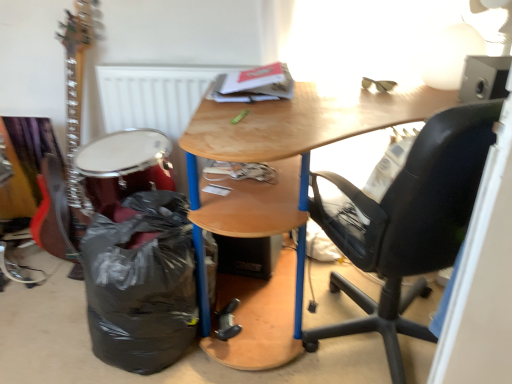
What do you see at coordinates (278, 198) in the screenshot?
I see `wooden desk at center` at bounding box center [278, 198].

The image size is (512, 384). What are the coordinates of `wooden desk at center` in the screenshot? It's located at (278, 198).

Describe the element at coordinates (156, 100) in the screenshot. This screenshot has height=384, width=512. I see `white matte radiator at upper center` at that location.

Find the location of a particular element. black leather office chair at right is located at coordinates (409, 223).

Considering the sizes of shiny red drum at lower left and black leather office chair at right in the image, is shiny red drum at lower left wider or thinner than black leather office chair at right?

Clearly, shiny red drum at lower left has less width compared to black leather office chair at right.

Is shiny red drum at lower left aimed at black leather office chair at right?

No, shiny red drum at lower left is not aimed at black leather office chair at right.

From a real-world perspective, is shiny red drum at lower left above or below black leather office chair at right?

In terms of real-world spatial position, shiny red drum at lower left is below black leather office chair at right.

From the image's perspective, between shiny red drum at lower left and black leather office chair at right, who is located below?

From the image's view, black leather office chair at right is below.

This screenshot has height=384, width=512. In order to click on desk that is above the shiny red drum at lower left (from a real-world perspective) in this screenshot , I will do `click(278, 198)`.

Considering the sizes of objects shiny red drum at lower left and wooden desk at center in the image provided, who is smaller, shiny red drum at lower left or wooden desk at center?

With smaller size is shiny red drum at lower left.

Is shiny red drum at lower left taller than wooden desk at center?

No, shiny red drum at lower left is not taller than wooden desk at center.

Which object is positioned more to the right, shiny red drum at lower left or wooden desk at center?

wooden desk at center.

Is wooden desk at center facing away from white matte radiator at upper center?

No, wooden desk at center is not facing away from white matte radiator at upper center.

From the image's perspective, which is below, wooden desk at center or white matte radiator at upper center?

wooden desk at center appears lower in the image.

Can you see black leather office chair at right touching wooden desk at center?

No, black leather office chair at right is not next to wooden desk at center.

Is black leather office chair at right not within wooden desk at center?

That's incorrect, black leather office chair at right is not completely outside wooden desk at center.

Could you tell me if black leather office chair at right is facing wooden desk at center?

Yes, black leather office chair at right is facing wooden desk at center.

Is wooden desk at center at the back of black plastic bag at lower left?

black plastic bag at lower left does not have its back to wooden desk at center.

From the image's perspective, is black plastic bag at lower left on wooden desk at center?

No, from the image's perspective, black plastic bag at lower left is not on top of wooden desk at center.

Could wooden desk at center be considered to be inside black plastic bag at lower left?

Definitely not — wooden desk at center is not inside black plastic bag at lower left.

From a real-world perspective, is black plastic bag at lower left over wooden desk at center?

No, from a real-world perspective, black plastic bag at lower left is not over wooden desk at center

Can you see black plastic bag at lower left touching black leather office chair at right?

No, black plastic bag at lower left is not in contact with black leather office chair at right.

Between black plastic bag at lower left and black leather office chair at right, which one has more height?

black leather office chair at right.

Image resolution: width=512 pixels, height=384 pixels. Identify the location of chair in front of the black plastic bag at lower left. click(x=409, y=223).

Considering the sizes of objects black plastic bag at lower left and black leather office chair at right in the image provided, who is thinner, black plastic bag at lower left or black leather office chair at right?

Thinner between the two is black plastic bag at lower left.

From a real-world perspective, is white matte radiator at upper center located higher than wooden desk at center?

Correct, in the physical world, white matte radiator at upper center is higher than wooden desk at center.

Is white matte radiator at upper center located outside wooden desk at center?

Indeed, white matte radiator at upper center is completely outside wooden desk at center.

How much distance is there between white matte radiator at upper center and wooden desk at center?

They are 18.29 inches apart.

Is white matte radiator at upper center aimed at wooden desk at center?

No, white matte radiator at upper center is not aimed at wooden desk at center.

Find the location of a particular element. chair below the shiny red drum at lower left (from the image's perspective) is located at coordinates (409, 223).

The image size is (512, 384). Find the location of `desk on the right of shiny red drum at lower left`. desk on the right of shiny red drum at lower left is located at coordinates (278, 198).

From the image, which object appears to be nearer to white matte radiator at upper center, black plastic bag at lower left or shiny red drum at lower left?

shiny red drum at lower left.

Which object lies further to the anchor point wooden desk at center, shiny red drum at lower left or black leather office chair at right?

The object further to wooden desk at center is shiny red drum at lower left.

Which object lies further to the anchor point white matte radiator at upper center, wooden desk at center or black leather office chair at right?

The object further to white matte radiator at upper center is black leather office chair at right.

From the image, which object appears to be nearer to black plastic bag at lower left, white matte radiator at upper center or shiny red drum at lower left?

shiny red drum at lower left.

From the image, which object appears to be farther from shiny red drum at lower left, black plastic bag at lower left or white matte radiator at upper center?

black plastic bag at lower left.

Based on their spatial positions, is black plastic bag at lower left or shiny red drum at lower left further from black leather office chair at right?

The object further to black leather office chair at right is shiny red drum at lower left.

Considering their positions, is shiny red drum at lower left positioned further to black plastic bag at lower left than wooden desk at center?

The object further to black plastic bag at lower left is wooden desk at center.

From the picture: Looking at the image, which one is located closer to shiny red drum at lower left, white matte radiator at upper center or black leather office chair at right?

white matte radiator at upper center is positioned closer to the anchor shiny red drum at lower left.

Locate an element on the screen. The image size is (512, 384). garbage positioned between wooden desk at center and white matte radiator at upper center from near to far is located at coordinates tap(141, 282).

Locate an element on the screen. drum located between black plastic bag at lower left and white matte radiator at upper center in the depth direction is located at coordinates (125, 165).

At what (x,y) coordinates should I click in order to perform the action: click on radiator between shiny red drum at lower left and wooden desk at center from left to right. Please return your answer as a coordinate pair (x, y). Image resolution: width=512 pixels, height=384 pixels. Looking at the image, I should click on (156, 100).

Image resolution: width=512 pixels, height=384 pixels. Identify the location of desk between shiny red drum at lower left and black leather office chair at right. (278, 198).